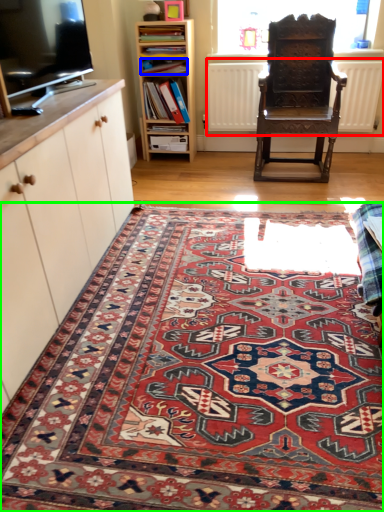
Question: Estimate the real-world distances between objects in this image. Which object is farther from radiator (highlighted by a red box), book (highlighted by a blue box) or mat (highlighted by a green box)?

Choices:
 (A) book
 (B) mat

Answer: (B)